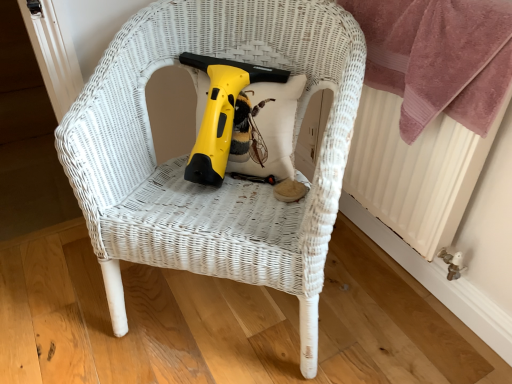
Question: Is white textured radiator at right outside yellow plastic electric drill at center?

Choices:
 (A) no
 (B) yes

Answer: (B)

Question: Is there a large distance between white textured radiator at right and yellow plastic electric drill at center?

Choices:
 (A) yes
 (B) no

Answer: (B)

Question: Is the position of white textured radiator at right more distant than that of yellow plastic electric drill at center?

Choices:
 (A) yes
 (B) no

Answer: (B)

Question: Considering the relative sizes of white textured radiator at right and yellow plastic electric drill at center in the image provided, is white textured radiator at right bigger than yellow plastic electric drill at center?

Choices:
 (A) yes
 (B) no

Answer: (A)

Question: From the image's perspective, is white textured radiator at right beneath yellow plastic electric drill at center?

Choices:
 (A) no
 (B) yes

Answer: (B)

Question: Is white textured radiator at right oriented towards yellow plastic electric drill at center?

Choices:
 (A) yes
 (B) no

Answer: (A)

Question: Is yellow plastic electric drill at center not within white wicker chair at center?

Choices:
 (A) no
 (B) yes

Answer: (A)

Question: From a real-world perspective, is yellow plastic electric drill at center on white wicker chair at center?

Choices:
 (A) no
 (B) yes

Answer: (B)

Question: Considering the relative sizes of yellow plastic electric drill at center and white wicker chair at center in the image provided, is yellow plastic electric drill at center wider than white wicker chair at center?

Choices:
 (A) yes
 (B) no

Answer: (B)

Question: Can you confirm if yellow plastic electric drill at center is taller than white wicker chair at center?

Choices:
 (A) no
 (B) yes

Answer: (A)

Question: Is yellow plastic electric drill at center oriented away from white wicker chair at center?

Choices:
 (A) yes
 (B) no

Answer: (A)

Question: Would you say white wicker chair at center is part of yellow plastic electric drill at center's contents?

Choices:
 (A) no
 (B) yes

Answer: (A)

Question: Is pink plush towel at upper right turned away from white wicker chair at center?

Choices:
 (A) no
 (B) yes

Answer: (A)